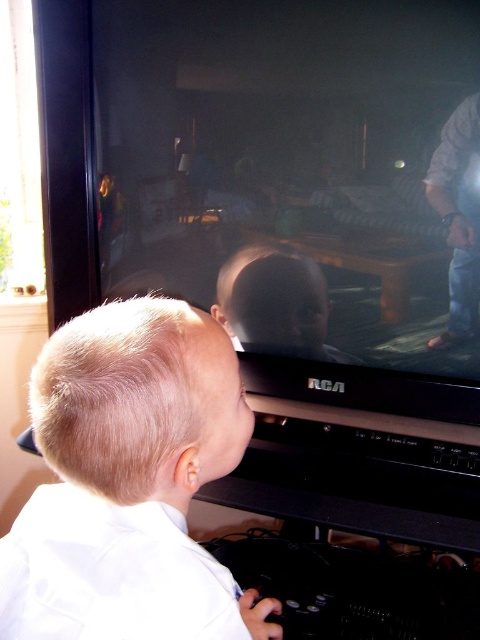
Can you confirm if blonde hair boy at lower left is positioned to the left of smooth plastic baby at center?

Yes, blonde hair boy at lower left is to the left of smooth plastic baby at center.

Between point (108, 563) and point (228, 294), which one is positioned behind?

Positioned behind is point (228, 294).

Find the location of a particular element. blonde hair boy at lower left is located at coordinates (132, 470).

Locate an element on the screen. The width and height of the screenshot is (480, 640). blonde hair boy at lower left is located at coordinates (132, 470).